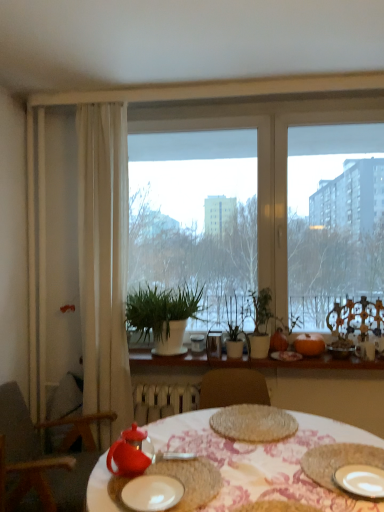
Question: Is matte glass bowl at right, which ranks as the first tableware in right-to-left order, at the back of matte red teapot at lower center, placed as the 1th tableware when sorted from left to right?

Choices:
 (A) yes
 (B) no

Answer: (B)

Question: Considering the relative sizes of matte red teapot at lower center, the first tableware viewed from the front, and matte glass bowl at right, which appears as the third tableware when viewed from the front, in the image provided, is matte red teapot at lower center, the first tableware viewed from the front, thinner than matte glass bowl at right, which appears as the third tableware when viewed from the front,?

Choices:
 (A) yes
 (B) no

Answer: (A)

Question: Is matte glass bowl at right, the fourth tableware when ordered from left to right, located within matte red teapot at lower center, placed as the 1th tableware when sorted from left to right?

Choices:
 (A) yes
 (B) no

Answer: (B)

Question: Does matte red teapot at lower center, the first tableware viewed from the front, appear on the right side of matte glass bowl at right, marked as the second tableware in a back-to-front arrangement?

Choices:
 (A) yes
 (B) no

Answer: (B)

Question: Can you confirm if matte red teapot at lower center, placed as the 1th tableware when sorted from left to right, is shorter than matte glass bowl at right, which appears as the third tableware when viewed from the front?

Choices:
 (A) yes
 (B) no

Answer: (B)

Question: From a real-world perspective, is matte red teapot at lower center, the fourth tableware in the back-to-front sequence, beneath matte glass bowl at right, the fourth tableware when ordered from left to right?

Choices:
 (A) no
 (B) yes

Answer: (B)

Question: Is metallic glass at center, the fourth tableware positioned from the front, wider than white matte plate at center, marked as the first plate in a left-to-right arrangement?

Choices:
 (A) yes
 (B) no

Answer: (B)

Question: Considering the relative sizes of metallic glass at center, the fourth tableware positioned from the front, and white matte plate at center, marked as the first plate in a left-to-right arrangement, in the image provided, is metallic glass at center, the fourth tableware positioned from the front, thinner than white matte plate at center, marked as the first plate in a left-to-right arrangement,?

Choices:
 (A) no
 (B) yes

Answer: (B)

Question: Is metallic glass at center, the first tableware when ordered from back to front, behind white matte plate at center, marked as the first plate in a left-to-right arrangement?

Choices:
 (A) yes
 (B) no

Answer: (A)

Question: Is metallic glass at center, the first tableware when ordered from back to front, positioned with its back to white matte plate at center, marked as the first plate in a left-to-right arrangement?

Choices:
 (A) no
 (B) yes

Answer: (A)

Question: Is metallic glass at center, the fourth tableware positioned from the front, surrounding white matte plate at center, marked as the first plate in a left-to-right arrangement?

Choices:
 (A) yes
 (B) no

Answer: (B)

Question: Does metallic glass at center, the third tableware when ordered from right to left, have a greater height compared to white matte plate at center, the 2th plate viewed from the right?

Choices:
 (A) yes
 (B) no

Answer: (A)

Question: Considering the relative sizes of white ceramic plate at lower right, placed as the first plate when sorted from right to left, and white matte plant pot at center in the image provided, is white ceramic plate at lower right, placed as the first plate when sorted from right to left, smaller than white matte plant pot at center?

Choices:
 (A) yes
 (B) no

Answer: (A)